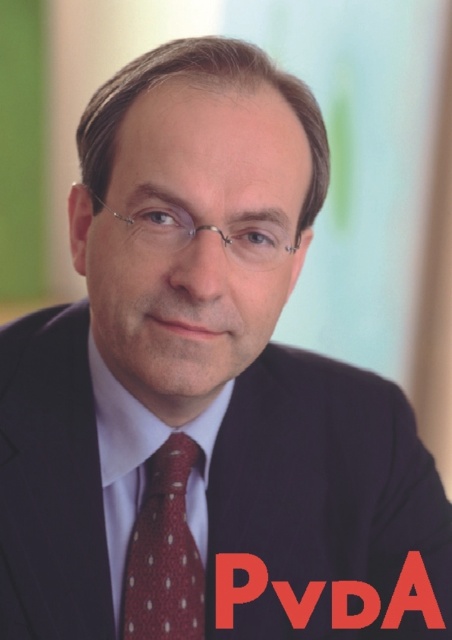
You are a fashion designer observing a man wearing a red dotted tie at center and a white smooth dress shirt at center. Which clothing item is positioned lower on his body?

The red dotted tie at center is located below the white smooth dress shirt at center, so it is positioned lower on his body.

You are a photographer adjusting your camera settings to focus on the subject. You notice the red dotted tie at center and the white smooth dress shirt at center. Which of these items is closer to your camera lens?

The red dotted tie at center is closer to the camera lens because it is described as being further to the viewer than the white smooth dress shirt at center.